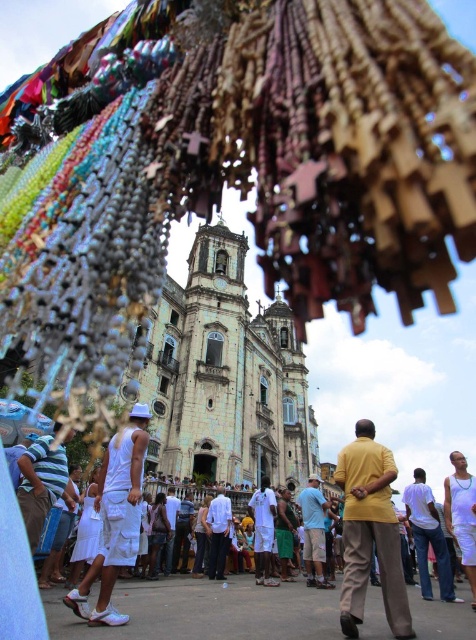
Is point (406, 618) positioned behind point (436, 552)?

That is False.

Does yellow matte shirt at center have a lesser width compared to white cotton shirt at center?

Yes.

Describe the element at coordinates (369, 532) in the screenshot. I see `yellow matte shirt at center` at that location.

This screenshot has height=640, width=476. Identify the location of yellow matte shirt at center. (369, 532).

Consider the image. Between yellow matte shirt at center and white matte tank top at center, which one is positioned higher?

yellow matte shirt at center

Identify the location of yellow matte shirt at center. pyautogui.click(x=369, y=532).

Between point (373, 460) and point (474, 509), which one is positioned behind?

The point (474, 509) is more distant.

Find the location of a particular element. The height and width of the screenshot is (640, 476). yellow matte shirt at center is located at coordinates (369, 532).

Is point (358, 589) farther from camera compared to point (103, 596)?

Yes, it is behind point (103, 596).

Between point (374, 492) and point (110, 545), which one is positioned behind?

The point (374, 492) is more distant.

Locate an element on the screen. Image resolution: width=476 pixels, height=640 pixels. yellow matte shirt at center is located at coordinates (369, 532).